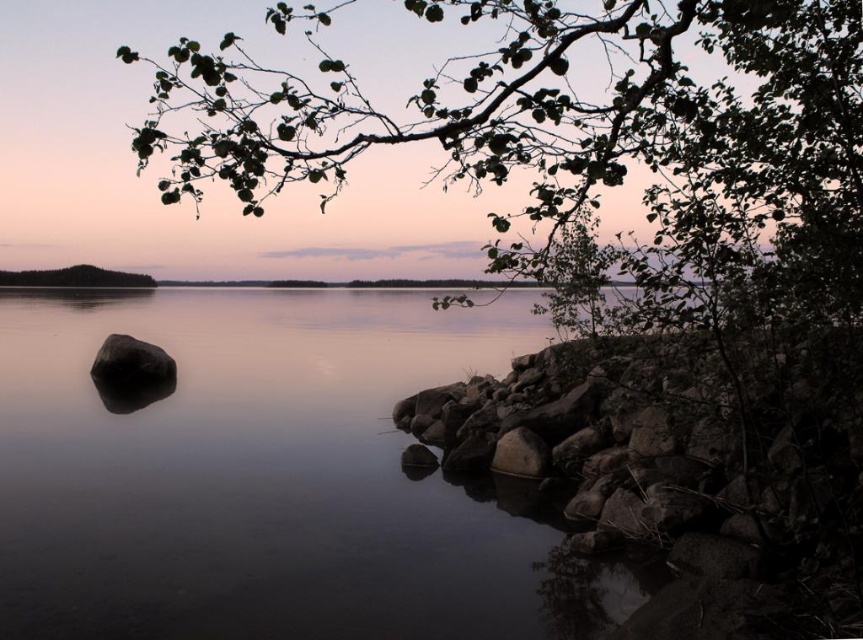
Question: Can you confirm if black smooth rock at left is positioned below green leafy tree at left?

Choices:
 (A) yes
 (B) no

Answer: (A)

Question: Is smooth water at center thinner than green leafy tree at left?

Choices:
 (A) yes
 (B) no

Answer: (B)

Question: Among these points, which one is farthest from the camera?

Choices:
 (A) (1, 432)
 (B) (186, 188)
 (C) (82, 269)
 (D) (112, 371)

Answer: (C)

Question: Which of these objects is positioned farthest from the black smooth rock at left?

Choices:
 (A) green leafy tree at left
 (B) green leafy branch at upper center

Answer: (B)

Question: Which object is positioned farthest from the smooth water at center?

Choices:
 (A) green leafy tree at left
 (B) black smooth rock at left
 (C) green leafy branch at upper center

Answer: (C)

Question: Does black smooth rock at left appear over green leafy tree at left?

Choices:
 (A) yes
 (B) no

Answer: (B)